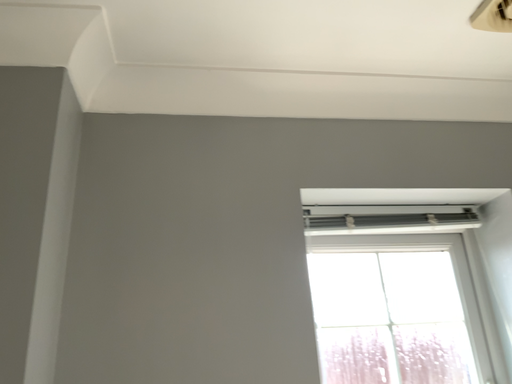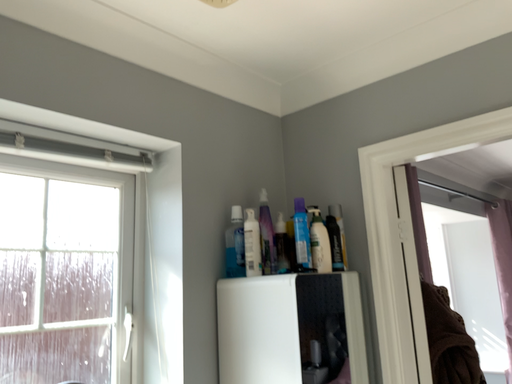
Question: How did the camera likely rotate when shooting the video?

Choices:
 (A) rotated upward
 (B) rotated downward

Answer: (B)